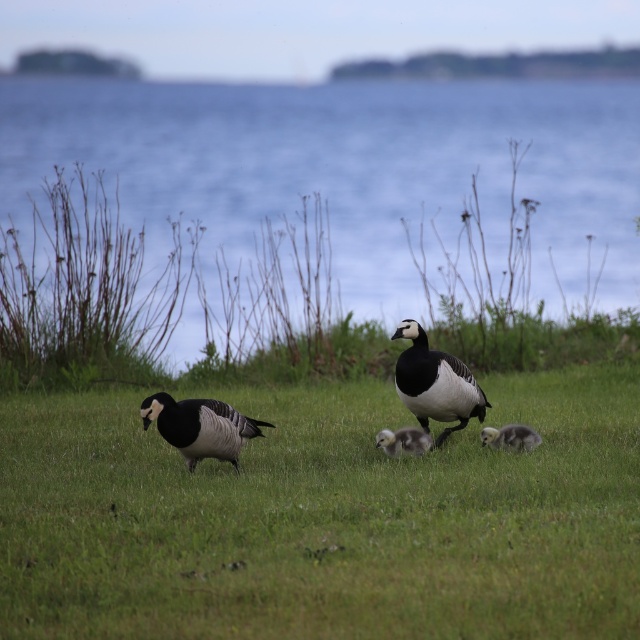
Is green grass at center thinner than blue water at upper center?

Yes.

Where is `green grass at center`? This screenshot has height=640, width=640. green grass at center is located at coordinates (x=324, y=518).

Does black glossy goose at center have a greater width compared to soft gray downy duckling at center?

Yes.

Is black glossy goose at center thinner than soft gray downy duckling at center?

Incorrect, black glossy goose at center's width is not less than soft gray downy duckling at center's.

You are a GUI agent. You are given a task and a screenshot of the screen. Output one action in this format:
    pyautogui.click(x=<x>, y=<y>)
    Task: Click on the black glossy goose at center
    The width and height of the screenshot is (640, 640).
    Given the screenshot: What is the action you would take?
    pos(435,384)

At what (x,y) coordinates should I click in order to perform the action: click on black glossy goose at center. Please return your answer as a coordinate pair (x, y). Looking at the image, I should click on (435, 384).

Which is in front, point (426, 397) or point (170, 403)?

Positioned in front is point (170, 403).

Is black glossy goose at center taller than black glossy duckling at center?

Yes, black glossy goose at center is taller than black glossy duckling at center.

This screenshot has width=640, height=640. What are the coordinates of `black glossy goose at center` in the screenshot? It's located at (435, 384).

Locate an element on the screen. black glossy goose at center is located at coordinates (435, 384).